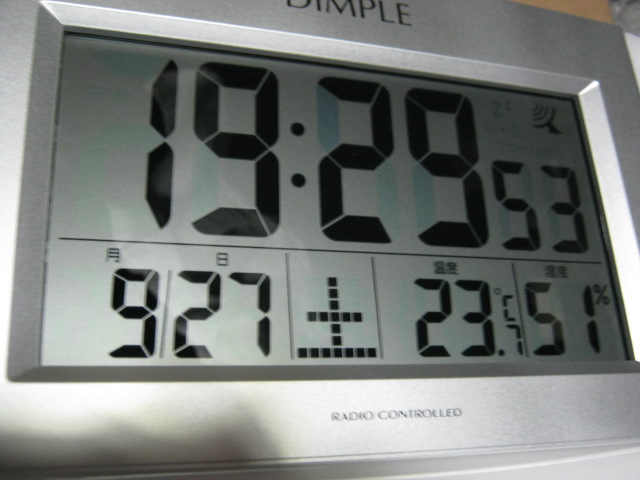
Identify the location of lcd screen. The image size is (640, 480). (513, 129).